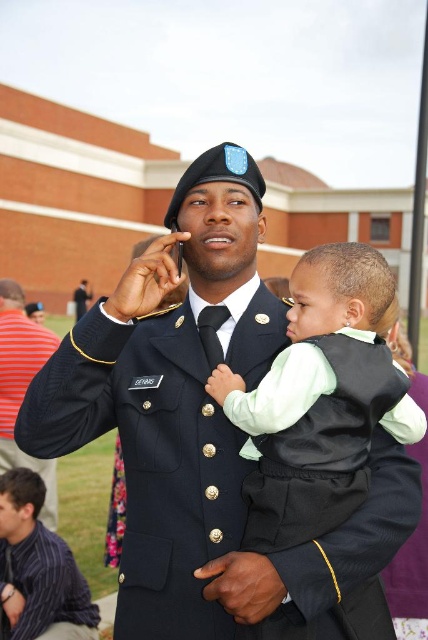
Does soft green fabric vest at center have a lesser width compared to brushed metal uniform at center?

Incorrect, soft green fabric vest at center's width is not less than brushed metal uniform at center's.

Who is positioned more to the right, soft green fabric vest at center or brushed metal uniform at center?

soft green fabric vest at center

This screenshot has height=640, width=428. In order to click on soft green fabric vest at center in this screenshot , I will do `click(324, 358)`.

Is uniformed man at center bigger than soft green fabric vest at center?

Yes.

Who is positioned more to the right, uniformed man at center or soft green fabric vest at center?

soft green fabric vest at center is more to the right.

This screenshot has height=640, width=428. I want to click on uniformed man at center, so click(202, 429).

Identify the location of uniformed man at center. (202, 429).

Who is more distant from viewer, (44, 401) or (89, 598)?

The point (89, 598) is more distant.

What do you see at coordinates (202, 429) in the screenshot? I see `uniformed man at center` at bounding box center [202, 429].

Where is `uniformed man at center`? The image size is (428, 640). uniformed man at center is located at coordinates (202, 429).

Where is `uniformed man at center`? The width and height of the screenshot is (428, 640). uniformed man at center is located at coordinates (202, 429).